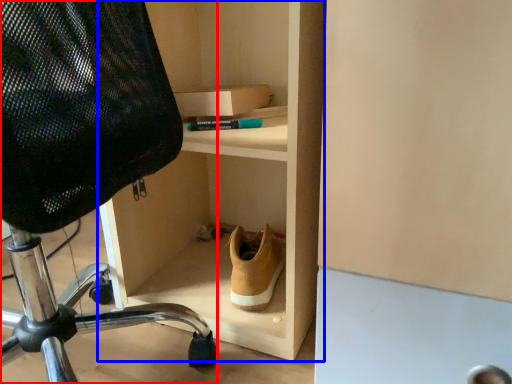
Question: Which object is further to the camera taking this photo, chair (highlighted by a red box) or shelf (highlighted by a blue box)?

Choices:
 (A) chair
 (B) shelf

Answer: (B)